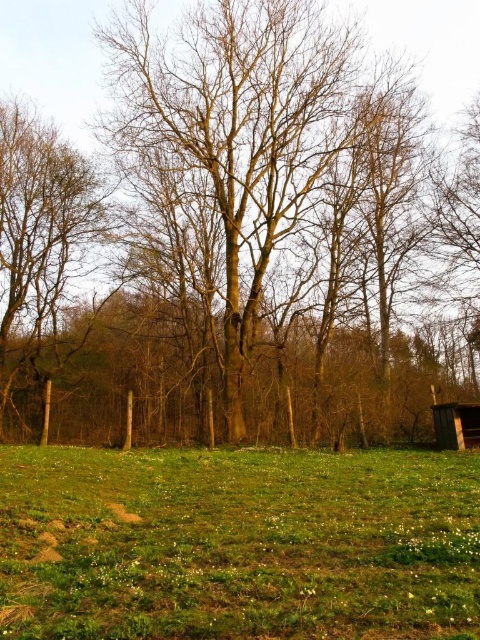
How much distance is there between green grassy field at center and bare wood tree at center?

The distance of green grassy field at center from bare wood tree at center is 55.85 feet.

Does point (264, 452) come farther from viewer compared to point (457, 97)?

That is False.

Is point (370, 554) farther from viewer compared to point (105, 13)?

No, it is in front of (105, 13).

You are a GUI agent. You are given a task and a screenshot of the screen. Output one action in this format:
    pyautogui.click(x=<x>, y=<y>)
    Task: Click on the green grassy field at center
    The width and height of the screenshot is (480, 640).
    Given the screenshot: What is the action you would take?
    pyautogui.click(x=238, y=544)

Is bare wood tree at center positioned behind brown rough tree at left?

No.

Does bare wood tree at center have a lesser height compared to brown rough tree at left?

Incorrect, bare wood tree at center's height does not fall short of brown rough tree at left's.

Where is `bare wood tree at center`? bare wood tree at center is located at coordinates (56, 60).

In the scene shown: Who is more forward, (367, 579) or (67, 253)?

Point (367, 579) is in front.

This screenshot has height=640, width=480. What are the coordinates of `green grassy field at center` in the screenshot? It's located at (238, 544).